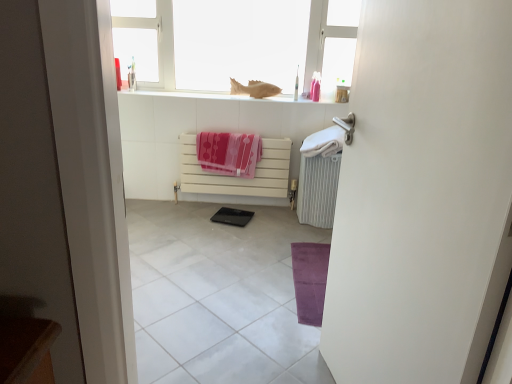
Identify the location of empty space that is ontop of white matte radiator at center (from a real-world perspective). (239, 129).